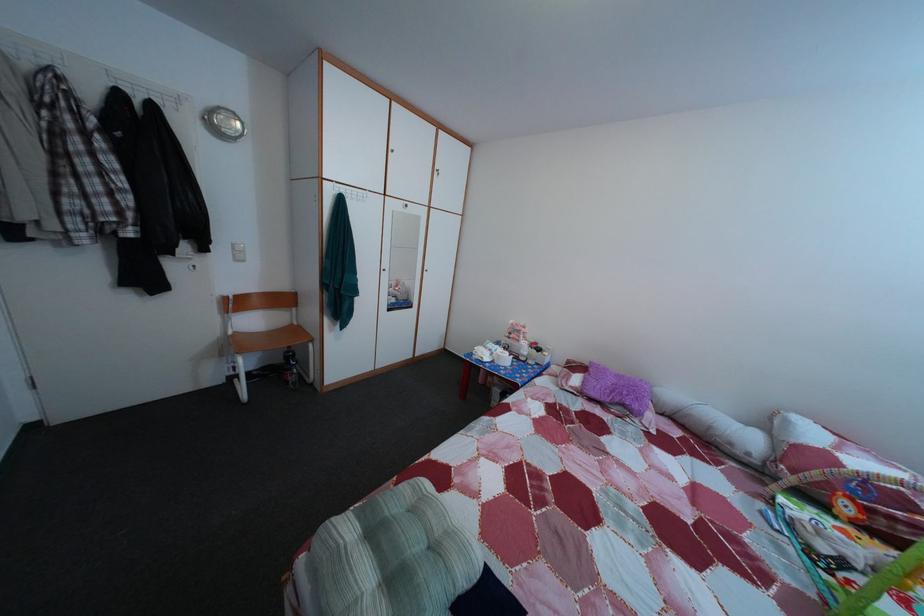
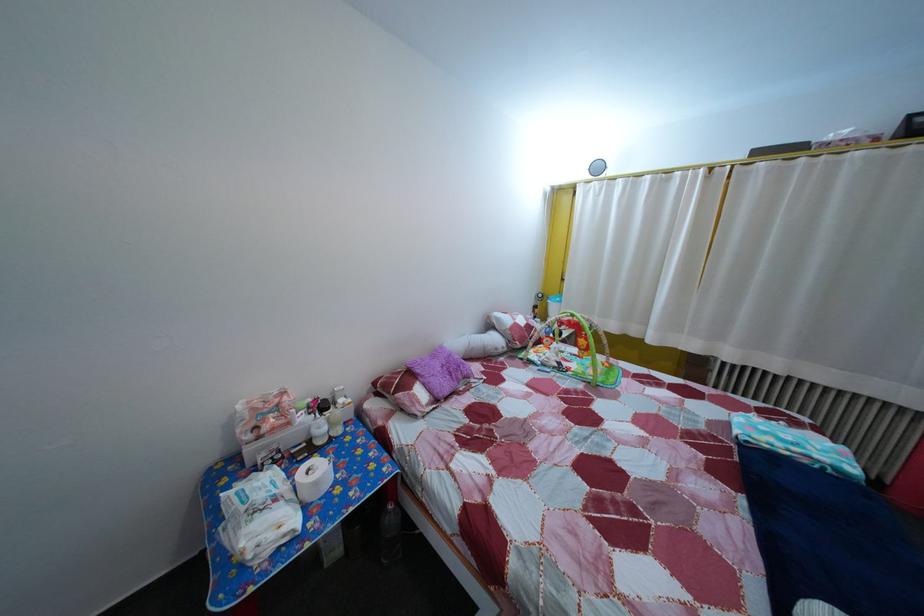
Locate, in the second image, the point that corresponds to [499,358] in the first image.

(285, 508)